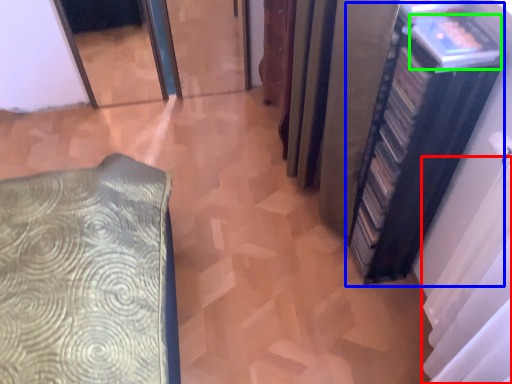
Question: Based on their relative distances, which object is nearer to curtain (highlighted by a red box)? Choose from bookshelf (highlighted by a blue box) and book (highlighted by a green box).

Choices:
 (A) bookshelf
 (B) book

Answer: (A)